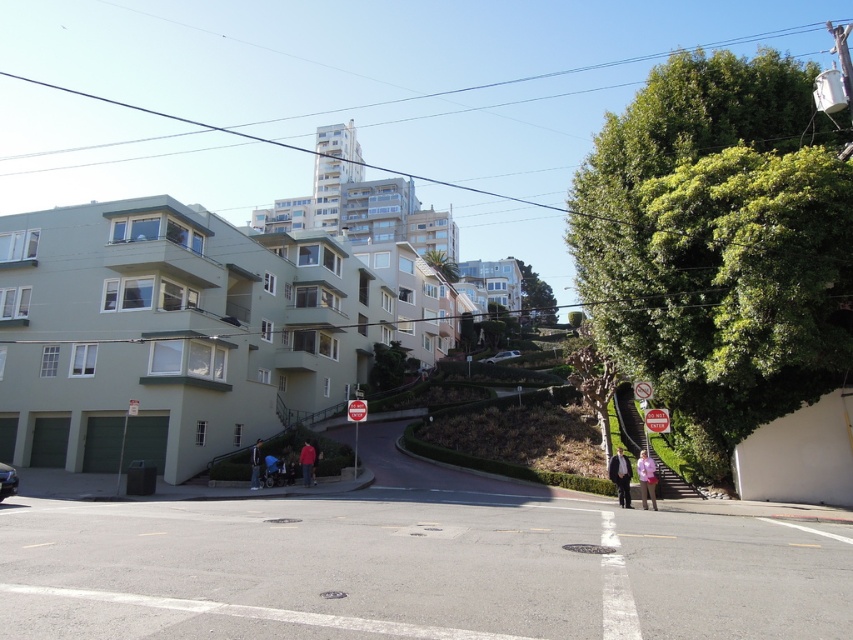
You are a delivery driver approaching the curved road in the image. You need to deliver a package to the buildings in the midground. Can your metallic silver sedan at lower left safely navigate the curve while avoiding the red plastic sign at center?

The metallic silver sedan at lower left is larger in size than the red plastic sign at center, so it can safely navigate the curve without hitting the sign as long as it stays on the road.